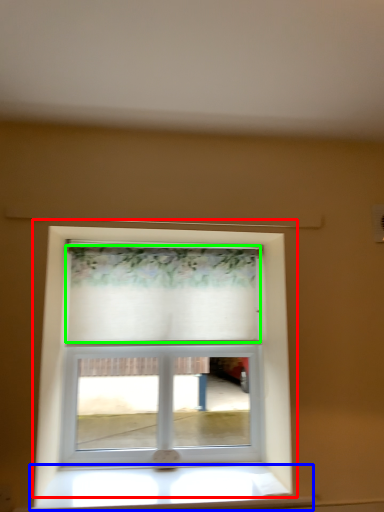
Question: Which object is the farthest from window (highlighted by a red box)? Choose among these: window sill (highlighted by a blue box) or curtain (highlighted by a green box).

Choices:
 (A) window sill
 (B) curtain

Answer: (A)